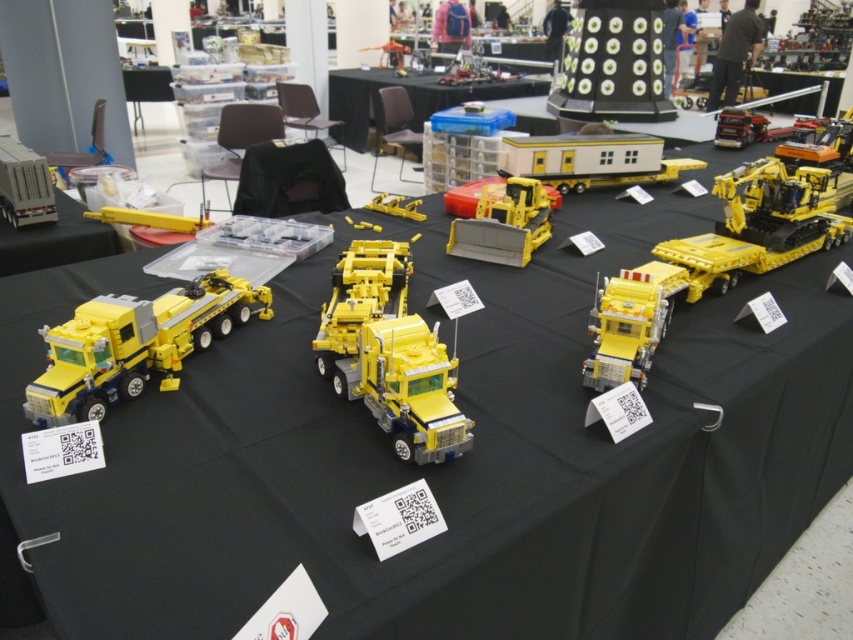
You are a visitor at the LEGO exhibition and want to take a photo of both the yellow plastic truck at center and the matte gray truck at left. Which truck should you stand closer to if you want both to be in the frame?

You should stand closer to the matte gray truck at left because the yellow plastic truck at center is positioned on the right side of it, so moving closer to the left truck will help keep both in the frame.

You are an event organizer at the LEGO exhibition and need to rearrange the display table. You want to place a new model that requires more space between the matte gray truck at left and the matte yellow construction vehicle at center. Based on their sizes, which object should you move to create more space?

Since the matte gray truck at left is wider than the matte yellow construction vehicle at center, you should move the matte gray truck at left to create more space between them.

You are a photographer standing at the edge of the table where the LEGO models are displayed. You want to take a photo that focuses on the point at the bottom right of the table. Which of the two points, point (669, 316) or point (26, 157), is closer to your camera to ensure it appears larger in the photo?

Point (669, 316) is closer to the camera than point (26, 157), so it will appear larger in the photo.